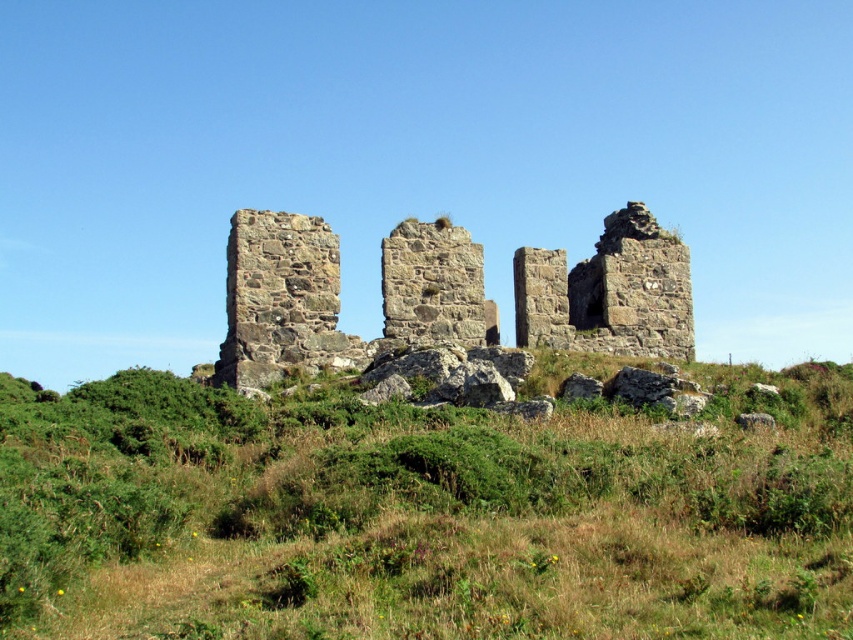
Between green grassy at center and rustic stone ruins at center, which one has less height?

Standing shorter between the two is green grassy at center.

Can you confirm if green grassy at center is wider than rustic stone ruins at center?

Correct, the width of green grassy at center exceeds that of rustic stone ruins at center.

Is point (410, 598) in front of point (595, 259)?

Yes, it is.

Find the location of a particular element. The height and width of the screenshot is (640, 853). green grassy at center is located at coordinates (427, 509).